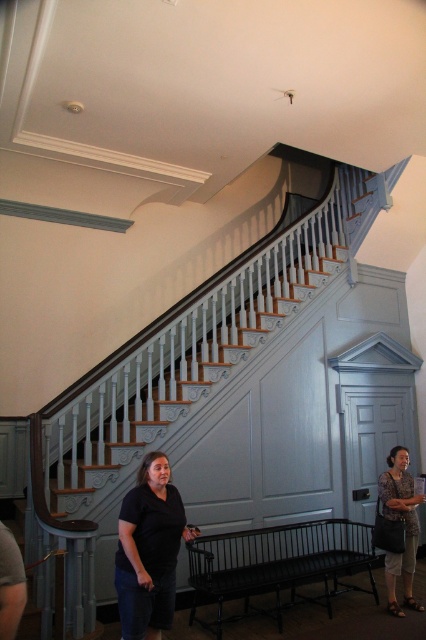
Question: Is black metal bench at lower center to the left of black cotton shirt at lower center from the viewer's perspective?

Choices:
 (A) yes
 (B) no

Answer: (B)

Question: Based on their relative distances, which object is nearer to the white wood staircase at center?

Choices:
 (A) printed fabric blouse at lower right
 (B) black metal bench at lower center

Answer: (B)

Question: Can you confirm if white wood staircase at center is wider than printed fabric blouse at lower right?

Choices:
 (A) yes
 (B) no

Answer: (A)

Question: Which of these objects is positioned closest to the printed fabric blouse at lower right?

Choices:
 (A) black cotton shirt at lower center
 (B) white wood staircase at center
 (C) black metal bench at lower center

Answer: (C)

Question: Which of these objects is positioned farthest from the printed fabric blouse at lower right?

Choices:
 (A) white wood staircase at center
 (B) black cotton shirt at lower center

Answer: (B)

Question: Can you confirm if black cotton shirt at lower center is positioned above printed fabric blouse at lower right?

Choices:
 (A) no
 (B) yes

Answer: (B)